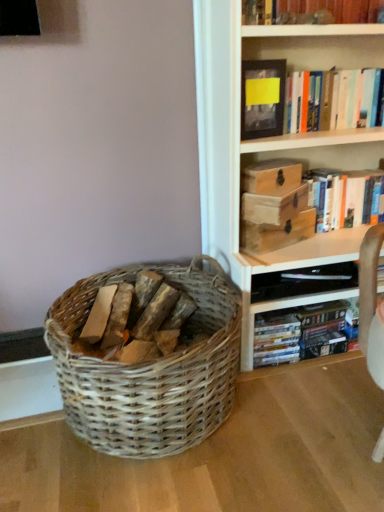
Question: Does wooden chest at upper right, positioned as the 1th storage box in bottom-to-top order, contain matte black shelf at lower right?

Choices:
 (A) yes
 (B) no

Answer: (B)

Question: From a real-world perspective, is wooden chest at upper right, positioned as the 1th storage box in bottom-to-top order, physically above matte black shelf at lower right?

Choices:
 (A) no
 (B) yes

Answer: (B)

Question: Could you tell me if wooden chest at upper right, positioned as the 1th storage box in bottom-to-top order, is turned towards matte black shelf at lower right?

Choices:
 (A) yes
 (B) no

Answer: (B)

Question: Considering the relative sizes of wooden chest at upper right, which is counted as the 3th storage box, starting from the top, and matte black shelf at lower right in the image provided, is wooden chest at upper right, which is counted as the 3th storage box, starting from the top, smaller than matte black shelf at lower right?

Choices:
 (A) yes
 (B) no

Answer: (A)

Question: Is wooden chest at upper right, positioned as the 1th storage box in bottom-to-top order, directly adjacent to matte black shelf at lower right?

Choices:
 (A) yes
 (B) no

Answer: (B)

Question: In terms of height, does wooden chest at upper right, which is counted as the 3th storage box, starting from the top, look taller or shorter compared to yellow paper at upper center?

Choices:
 (A) tall
 (B) short

Answer: (B)

Question: Choose the correct answer: Is wooden chest at upper right, positioned as the 1th storage box in bottom-to-top order, inside yellow paper at upper center or outside it?

Choices:
 (A) outside
 (B) inside

Answer: (A)

Question: Does point 254,243 appear closer or farther from the camera than point 264,62?

Choices:
 (A) farther
 (B) closer

Answer: (A)

Question: Is wooden chest at upper right, positioned as the 1th storage box in bottom-to-top order, wider or thinner than yellow paper at upper center?

Choices:
 (A) wide
 (B) thin

Answer: (A)

Question: Is wooden chest at upper right, which is counted as the 3th storage box, starting from the top, in front of or behind matte black shelf at lower right in the image?

Choices:
 (A) behind
 (B) front

Answer: (B)

Question: From a real-world perspective, relative to matte black shelf at lower right, is wooden chest at upper right, which is counted as the 3th storage box, starting from the top, vertically above or below?

Choices:
 (A) above
 (B) below

Answer: (A)

Question: Is wooden chest at upper right, which is counted as the 3th storage box, starting from the top, bigger or smaller than matte black shelf at lower right?

Choices:
 (A) small
 (B) big

Answer: (A)

Question: From the image's perspective, is wooden chest at upper right, positioned as the 1th storage box in bottom-to-top order, located above or below matte black shelf at lower right?

Choices:
 (A) below
 (B) above

Answer: (B)

Question: Relative to hardcover book at upper right, arranged as the second book when ordered from the bottom, is wooden book at upper right, the 3th book in the bottom-to-top sequence, in front or behind?

Choices:
 (A) behind
 (B) front

Answer: (B)

Question: Considering the positions of point (241, 12) and point (244, 97), is point (241, 12) closer or farther from the camera than point (244, 97)?

Choices:
 (A) closer
 (B) farther

Answer: (A)